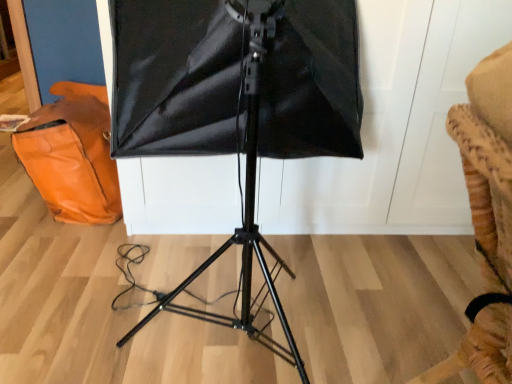
This screenshot has height=384, width=512. Describe the element at coordinates (72, 155) in the screenshot. I see `orange leather messenger bag at left` at that location.

Identify the location of orange leather messenger bag at left. The width and height of the screenshot is (512, 384). (72, 155).

This screenshot has width=512, height=384. In order to click on orange leather messenger bag at left in this screenshot , I will do `click(72, 155)`.